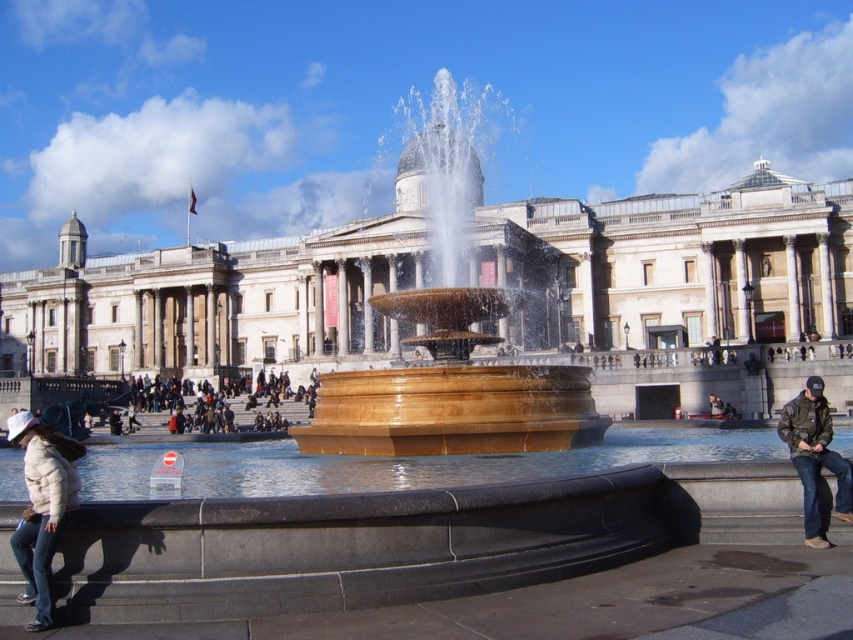
Who is higher up, marble building at center or white matte jacket at lower left?

marble building at center is higher up.

Measure the distance from marble building at center to white matte jacket at lower left.

The distance of marble building at center from white matte jacket at lower left is 42.95 meters.

Which is behind, point (123, 323) or point (33, 580)?

The point (123, 323) is more distant.

Locate an element on the screen. marble building at center is located at coordinates (456, 280).

Does marble building at center have a smaller size compared to camouflage jacket at lower right?

No.

Which of these two, marble building at center or camouflage jacket at lower right, stands shorter?

camouflage jacket at lower right is shorter.

Between point (321, 342) and point (816, 484), which one is positioned in front?

Point (816, 484) is more forward.

What are the coordinates of `marble building at center` in the screenshot? It's located at (456, 280).

Which is in front, point (799, 352) or point (428, 449)?

Point (428, 449) is in front.

Who is lower down, marble building at center or golden stone fountain at center?

marble building at center is below.

At what (x,y) coordinates should I click in order to perform the action: click on marble building at center. Please return your answer as a coordinate pair (x, y). This screenshot has width=853, height=640. Looking at the image, I should click on (456, 280).